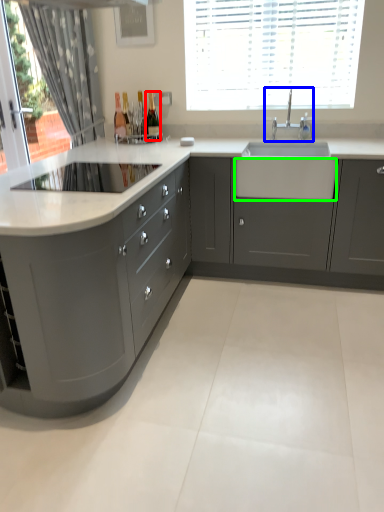
Question: Estimate the real-world distances between objects in this image. Which object is farther from bottle (highlighted by a red box), tap (highlighted by a blue box) or drawer (highlighted by a green box)?

Choices:
 (A) tap
 (B) drawer

Answer: (B)